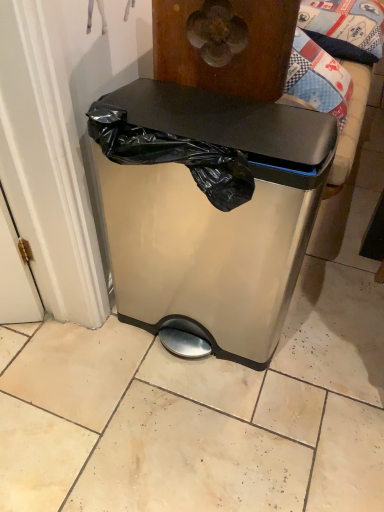
Identify the location of vacant area that lies in front of satin silver trash can at center. (187, 437).